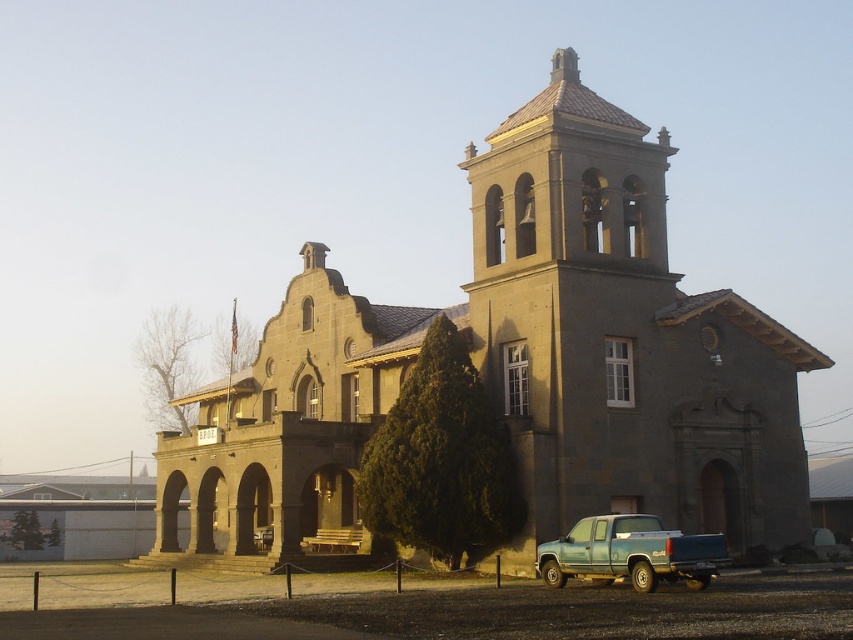
How far apart are gray stone church at center and teal matte truck at lower right?

A distance of 15.16 meters exists between gray stone church at center and teal matte truck at lower right.

Image resolution: width=853 pixels, height=640 pixels. Describe the element at coordinates (518, 364) in the screenshot. I see `gray stone church at center` at that location.

Identify the location of gray stone church at center. The width and height of the screenshot is (853, 640). (518, 364).

Is gray stone church at center to the left of gray stone bell tower at center from the viewer's perspective?

Correct, you'll find gray stone church at center to the left of gray stone bell tower at center.

Does gray stone church at center have a greater width compared to gray stone bell tower at center?

Correct, the width of gray stone church at center exceeds that of gray stone bell tower at center.

Who is more distant from viewer, (463, 307) or (624, 173)?

Point (463, 307)

You are a GUI agent. You are given a task and a screenshot of the screen. Output one action in this format:
    pyautogui.click(x=<x>, y=<y>)
    Task: Click on the gray stone church at center
    The image size is (853, 640).
    Given the screenshot: What is the action you would take?
    pyautogui.click(x=518, y=364)

Who is shorter, gray stone bell tower at center or teal matte truck at lower right?

teal matte truck at lower right is shorter.

Locate an element on the screen. The width and height of the screenshot is (853, 640). gray stone bell tower at center is located at coordinates (575, 305).